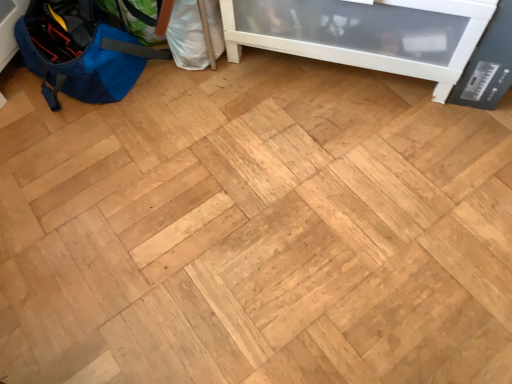
Question: Should I look upward or downward to see blue fabric backpack at left?

Choices:
 (A) down
 (B) up

Answer: (B)